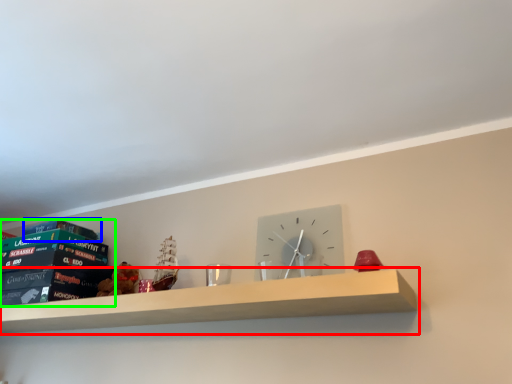
Question: Based on their relative distances, which object is farther from shelf (highlighted by a red box)? Choose from paperback book (highlighted by a blue box) and paperback book (highlighted by a green box).

Choices:
 (A) paperback book
 (B) paperback book

Answer: (A)